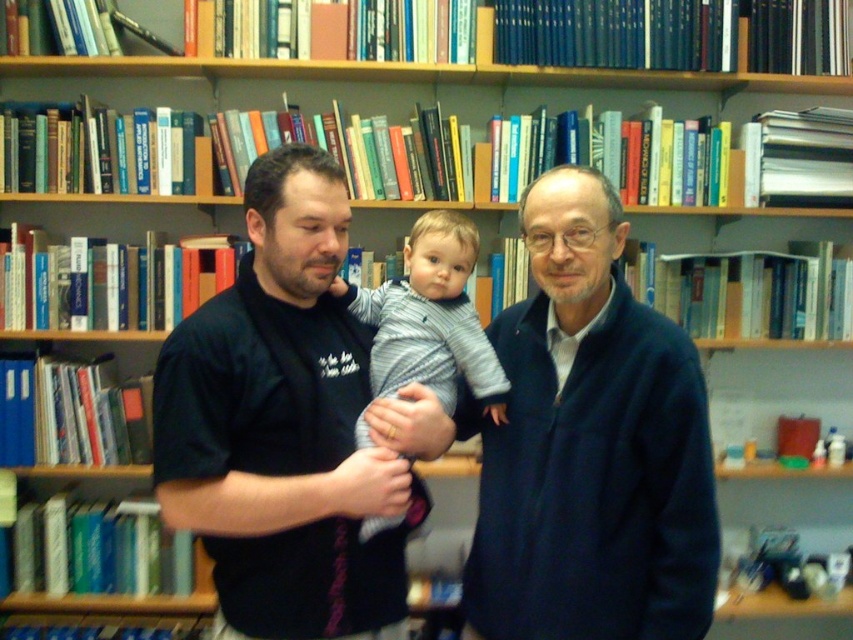
You are trying to decide which sweater to take for a casual day out. Both the navy blue sweater at center and the striped knit sweater at center are available. Based on their sizes, which one would you choose if you prefer a more oversized look?

The navy blue sweater at center is larger in size than the striped knit sweater at center, so you should choose the navy blue sweater at center for an oversized look.

Please look at the image. There is a navy blue sweater at center. Can you tell me where exactly it is located in terms of coordinates?

The navy blue sweater at center is located at coordinates point (590,445).